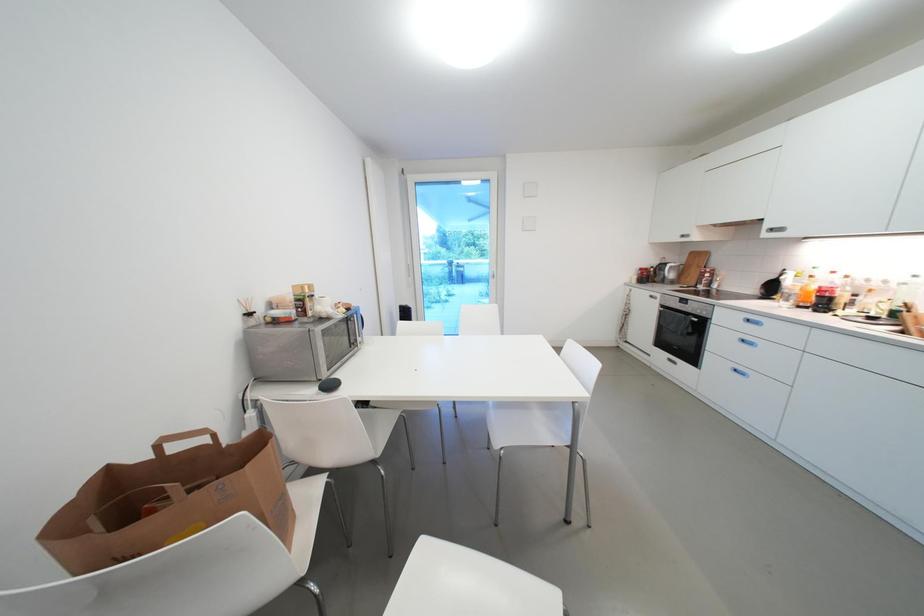
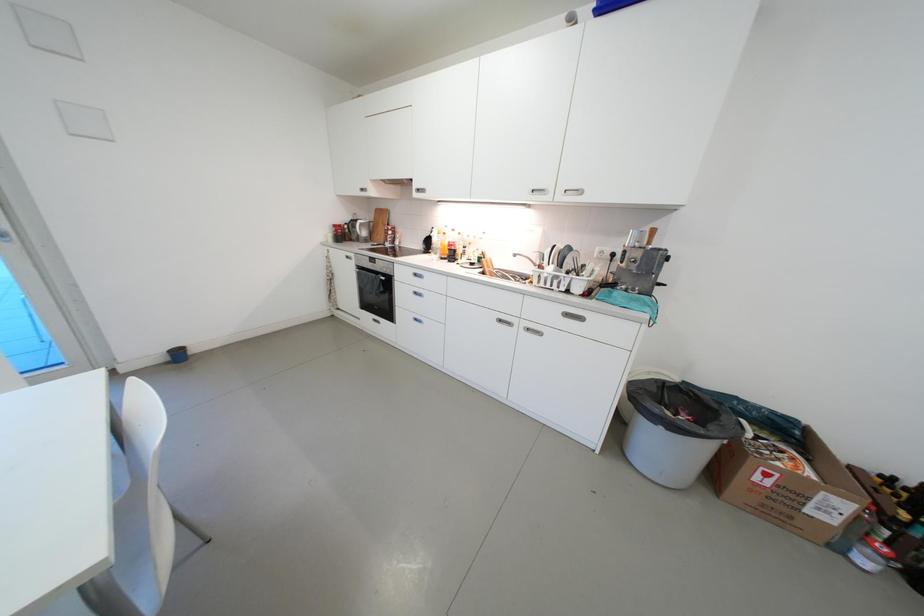
Question: The first image is from the beginning of the video and the second image is from the end. How did the camera likely rotate when shooting the video?

Choices:
 (A) Left
 (B) Right
 (C) Up
 (D) Down

Answer: (B)